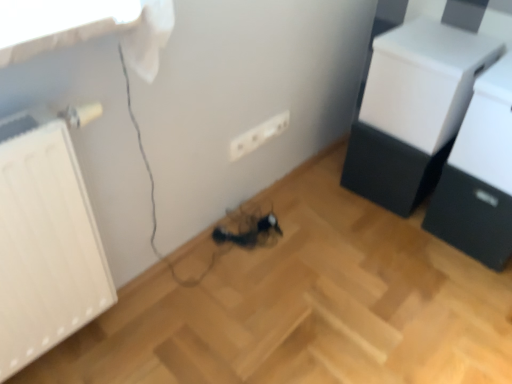
Question: From a real-world perspective, is black matte drawer at lower right physically below white matte drawer at upper right, the second furniture from the right?

Choices:
 (A) no
 (B) yes

Answer: (B)

Question: Is black matte drawer at lower right not within white matte drawer at upper right, arranged as the first furniture when viewed from the left?

Choices:
 (A) no
 (B) yes

Answer: (B)

Question: Can you confirm if black matte drawer at lower right is shorter than white matte drawer at upper right, the second furniture from the right?

Choices:
 (A) no
 (B) yes

Answer: (B)

Question: Can you confirm if black matte drawer at lower right is smaller than white matte drawer at upper right, arranged as the first furniture when viewed from the left?

Choices:
 (A) yes
 (B) no

Answer: (B)

Question: Considering the relative sizes of black matte drawer at lower right and white matte drawer at upper right, arranged as the first furniture when viewed from the left, in the image provided, is black matte drawer at lower right thinner than white matte drawer at upper right, arranged as the first furniture when viewed from the left,?

Choices:
 (A) no
 (B) yes

Answer: (A)

Question: Is the position of black matte drawer at lower right more distant than that of white matte drawer at upper right, arranged as the first furniture when viewed from the left?

Choices:
 (A) no
 (B) yes

Answer: (B)

Question: Can you confirm if white glossy printer at upper right, which appears as the 1th furniture when viewed from the right, is bigger than white matte radiator at left?

Choices:
 (A) yes
 (B) no

Answer: (B)

Question: Does white glossy printer at upper right, which appears as the 1th furniture when viewed from the right, have a smaller size compared to white matte radiator at left?

Choices:
 (A) yes
 (B) no

Answer: (A)

Question: Could you tell me if white glossy printer at upper right, placed as the 2th furniture when sorted from left to right, is facing white matte radiator at left?

Choices:
 (A) yes
 (B) no

Answer: (B)

Question: From the image's perspective, is white glossy printer at upper right, which appears as the 1th furniture when viewed from the right, below white matte radiator at left?

Choices:
 (A) no
 (B) yes

Answer: (A)

Question: Is white glossy printer at upper right, placed as the 2th furniture when sorted from left to right, touching white matte radiator at left?

Choices:
 (A) yes
 (B) no

Answer: (B)

Question: Does white glossy printer at upper right, which appears as the 1th furniture when viewed from the right, come in front of white matte radiator at left?

Choices:
 (A) yes
 (B) no

Answer: (B)

Question: Does white matte radiator at left have a larger size compared to black matte drawer at lower right?

Choices:
 (A) yes
 (B) no

Answer: (A)